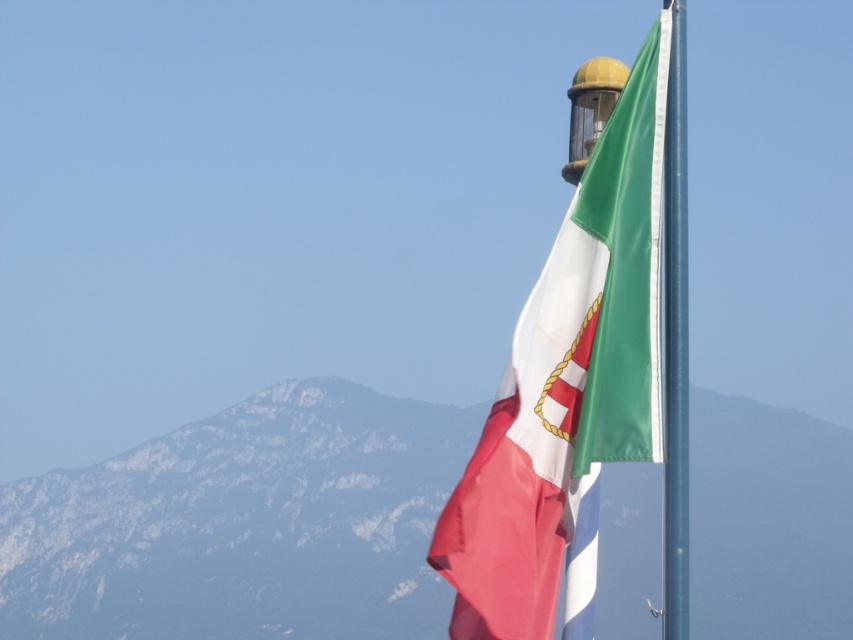
You are a photographer trying to capture the matte fabric flag at upper right and the metallic flag pole at right in your shot. Which object will appear closer to the camera in the photo?

The matte fabric flag at upper right will appear closer to the camera because it is in front of the metallic flag pole at right.

You are a hiker planning to take a photo of the rocky mountain at center and the matte fabric flag at upper right. Which object will occupy more horizontal space in your photo?

The rocky mountain at center will occupy more horizontal space in the photo because its width surpasses that of the matte fabric flag at upper right.